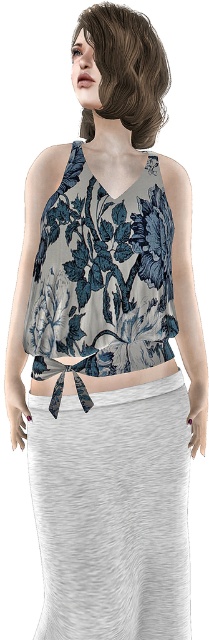
Measure the distance from brown matte hair at upper center to floral fabric top at center.

brown matte hair at upper center is 27.81 inches away from floral fabric top at center.

Who is shorter, brown matte hair at upper center or floral fabric top at center?

Standing shorter between the two is floral fabric top at center.

Looking at this image, who is more distant from viewer, (76, 32) or (141, 371)?

Positioned behind is point (76, 32).

This screenshot has width=209, height=640. I want to click on brown matte hair at upper center, so click(x=127, y=68).

Which is more to the right, floral-patterned fabric top at center or brown matte hair at upper center?

From the viewer's perspective, brown matte hair at upper center appears more on the right side.

Is point (131, 193) positioned in front of point (81, 28)?

Yes, point (131, 193) is closer to viewer.

Which is behind, point (146, 340) or point (90, 125)?

The point (90, 125) is more distant.

The image size is (209, 640). In order to click on floral-patterned fabric top at center in this screenshot , I will do `click(101, 276)`.

Can you confirm if floral-patterned fabric top at center is bigger than floral fabric top at center?

Indeed, floral-patterned fabric top at center has a larger size compared to floral fabric top at center.

Is floral-patterned fabric top at center in front of floral fabric top at center?

Yes.

Between point (49, 276) and point (163, 365), which one is positioned in front?

Point (49, 276) is in front.

Locate an element on the screen. The image size is (209, 640). floral-patterned fabric top at center is located at coordinates (101, 276).